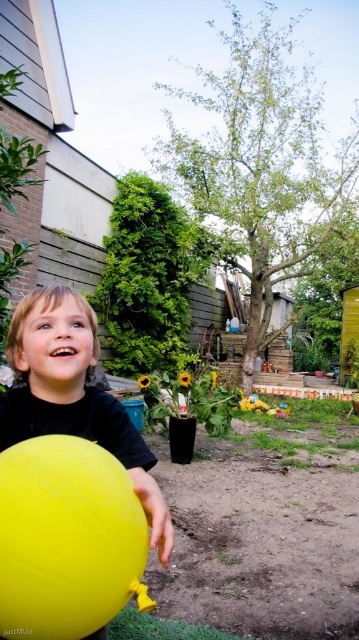
You are a photographer trying to capture the yellow rubber balloon at lower left in the center of your photo. Given its current position at point 0.842 on the x axis and 0.187 on the y axis, what direction should you move your camera to center it?

To center the yellow rubber balloon at lower left, you should move the camera to the right along the x axis and upwards along the y axis since the balloon is currently located at coordinates 0.842 on the x and 0.187 on the y. The center of the photo would be at 0.5 on both axes, so moving right decreases the x value and moving up increases the y value. Wait, actually, in standard coordinate systems, increasing x goes right and y goes up, so if the balloon is at x 0.842, which is to the right of center, you

You are a parent trying to decide whether to let your child hold both the yellow rubber balloon at center and the plastic yellow toy at lower center at the same time. Based on their sizes, do you think the child can hold both comfortably?

The yellow rubber balloon at center is larger in width than the plastic yellow toy at lower center. Since the balloon is bigger, it might be challenging for the child to hold both comfortably at the same time.

From the picture: You are a photographer trying to capture the yellow rubber balloon at center in the image. The camera has a focal point that can only focus on objects within a 0.1 unit radius around the center point. Is the balloon within the focus range?

The yellow rubber balloon at center is located at point (72, 394). The distance from the center point is sqrt of 0.617 squared plus 0.203 squared, which is approximately 0.653 units. Since the focus range is only 0.1 units, the balloon is outside the focus range.